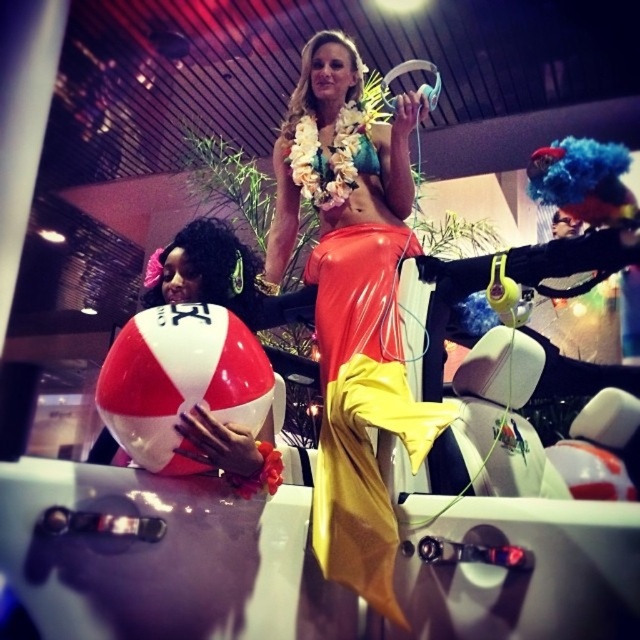
Measure the distance from shiny orange latex dress at center to white/red rubber beach ball at left.

They are 19.46 inches apart.

Which is above, shiny orange latex dress at center or white/red rubber beach ball at left?

shiny orange latex dress at center is higher up.

You are a GUI agent. You are given a task and a screenshot of the screen. Output one action in this format:
    pyautogui.click(x=<x>, y=<y>)
    Task: Click on the shiny orange latex dress at center
    
    Given the screenshot: What is the action you would take?
    click(x=353, y=305)

Does point (348, 330) lie behind point (579, 208)?

Yes, it is behind point (579, 208).

What do you see at coordinates (353, 305) in the screenshot? I see `shiny orange latex dress at center` at bounding box center [353, 305].

At what (x,y) coordinates should I click in order to perform the action: click on shiny orange latex dress at center. Please return your answer as a coordinate pair (x, y). This screenshot has height=640, width=640. Looking at the image, I should click on (353, 305).

Is point (180, 401) positioned after point (563, 179)?

No, (180, 401) is in front of (563, 179).

Measure the distance from white/red rubber beach ball at left to blue fuzzy wig at upper right.

white/red rubber beach ball at left and blue fuzzy wig at upper right are 39.30 inches apart.

The height and width of the screenshot is (640, 640). In order to click on white/red rubber beach ball at left in this screenshot , I will do `click(179, 380)`.

The image size is (640, 640). I want to click on white/red rubber beach ball at left, so click(179, 380).